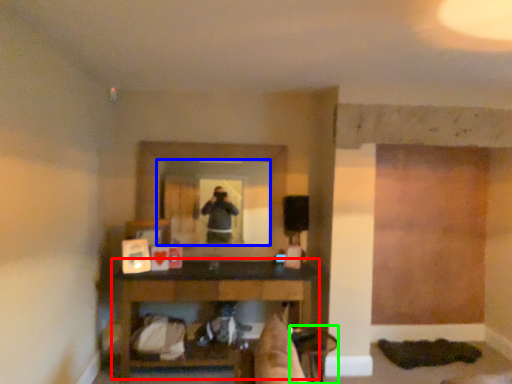
Question: Considering the real-world distances, which object is closest to table (highlighted by a red box)? mirror (highlighted by a blue box) or chair (highlighted by a green box).

Choices:
 (A) mirror
 (B) chair

Answer: (A)